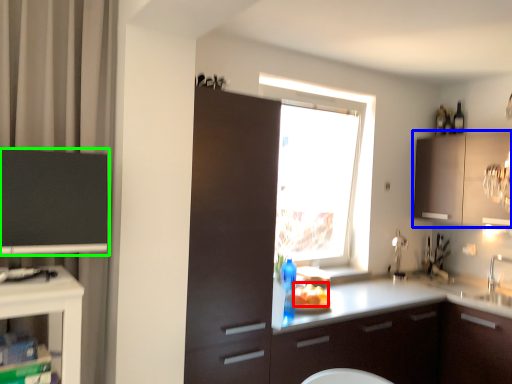
Question: Based on their relative distances, which object is farther from food (highlighted by a red box)? Choose from cabinetry (highlighted by a blue box) and cabinetry (highlighted by a green box).

Choices:
 (A) cabinetry
 (B) cabinetry

Answer: (B)